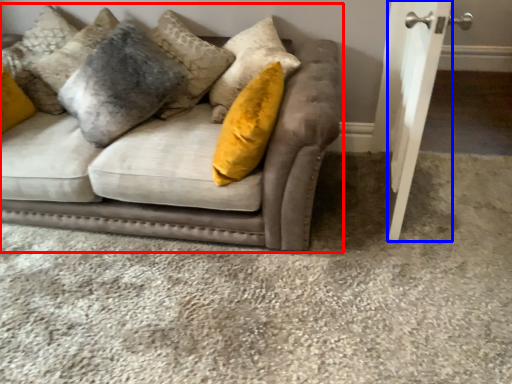
Question: Which object is further to the camera taking this photo, studio couch (highlighted by a red box) or door (highlighted by a blue box)?

Choices:
 (A) studio couch
 (B) door

Answer: (A)